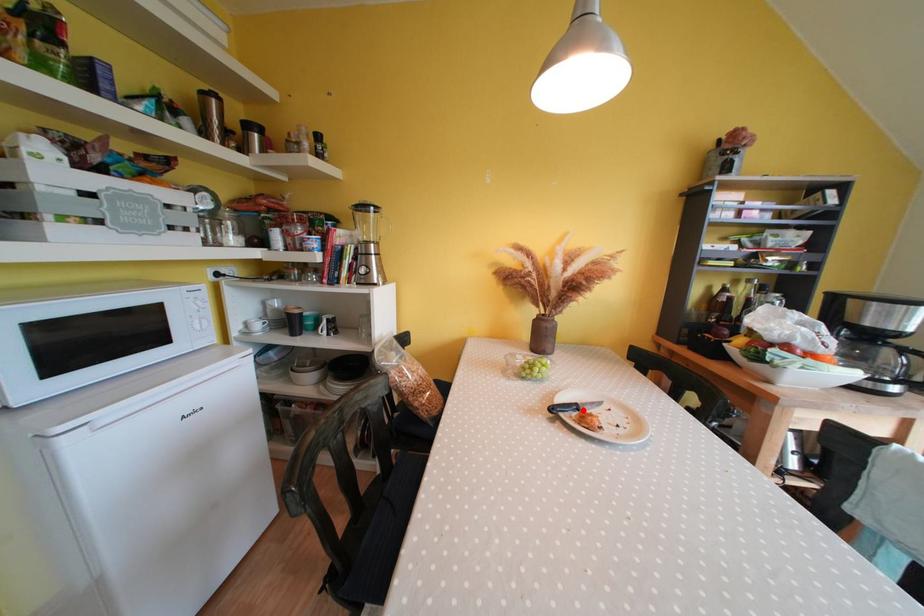
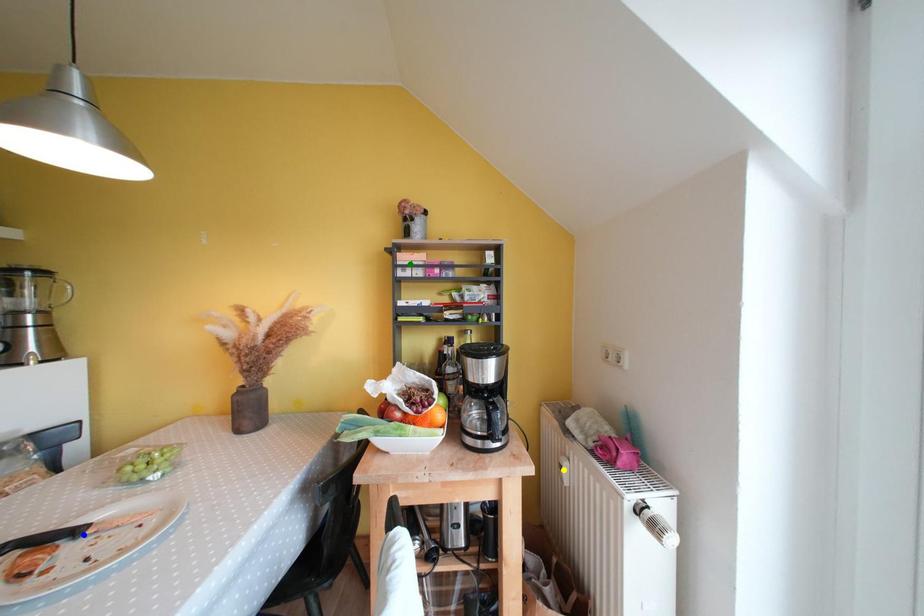
Question: I am providing you with two images of the same scene from different viewpoints. A red point is marked on the first image. You are given multiple points on the second image. Can you choose the point in image 2 that corresponds to the point in image 1?

Choices:
 (A) green point
 (B) blue point
 (C) yellow point

Answer: (B)